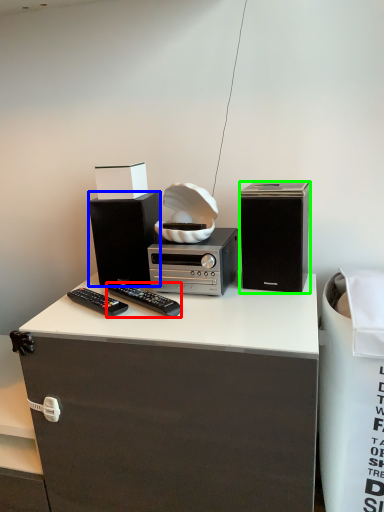
Question: Which object is positioned closest to remote control (highlighted by a red box)? Select from loudspeaker (highlighted by a blue box) and loudspeaker (highlighted by a green box).

Choices:
 (A) loudspeaker
 (B) loudspeaker

Answer: (A)